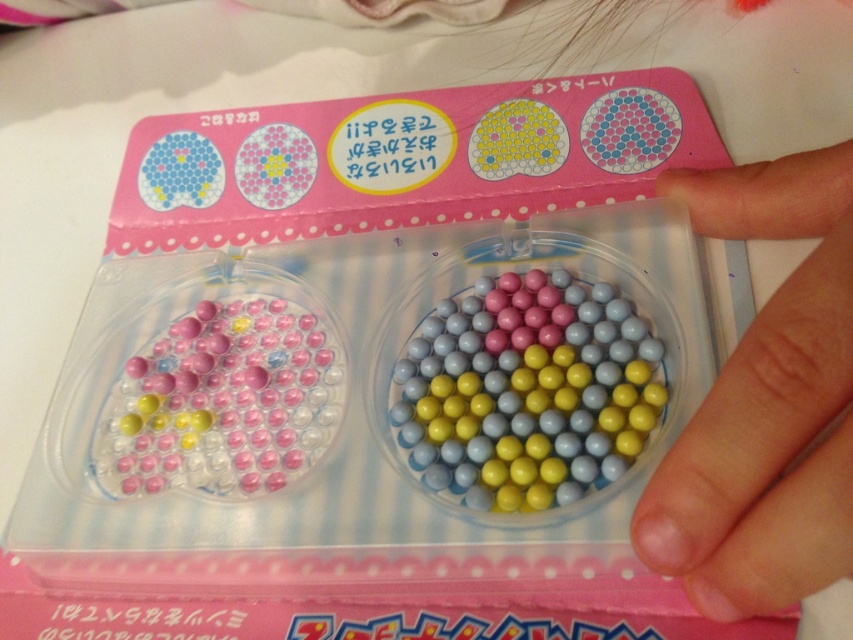
Does point (554, 452) come in front of point (221, 358)?

Yes, point (554, 452) is closer to viewer.

Between point (579, 307) and point (315, 388), which one is positioned behind?

Positioned behind is point (315, 388).

Find the location of a particular element. This screenshot has height=640, width=853. glossy plastic beads at center is located at coordinates (527, 392).

Which is more to the right, smooth skin at lower right or glossy plastic beads at center?

smooth skin at lower right

What do you see at coordinates (764, 404) in the screenshot?
I see `smooth skin at lower right` at bounding box center [764, 404].

Image resolution: width=853 pixels, height=640 pixels. Find the location of `smooth skin at lower right`. smooth skin at lower right is located at coordinates (764, 404).

Who is taller, smooth skin at lower right or matte plastic beads at center?

With more height is smooth skin at lower right.

Can you confirm if smooth skin at lower right is positioned below matte plastic beads at center?

No.

Measure the distance between smooth skin at lower right and camera.

The distance of smooth skin at lower right from camera is 11.96 inches.

Identify the location of smooth skin at lower right. This screenshot has width=853, height=640. (764, 404).